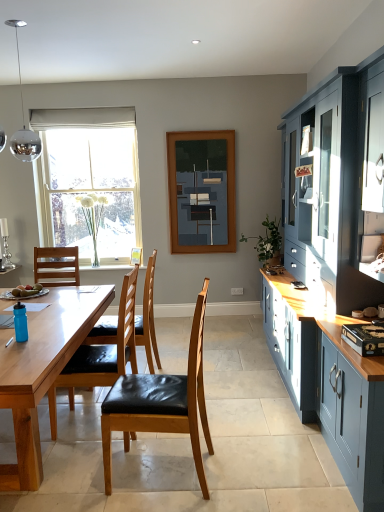
Question: Is polished chrome globe at upper left oriented towards blue plastic power plugs and sockets at lower left?

Choices:
 (A) no
 (B) yes

Answer: (A)

Question: From the image's perspective, is polished chrome globe at upper left under blue plastic power plugs and sockets at lower left?

Choices:
 (A) no
 (B) yes

Answer: (A)

Question: Is the depth of polished chrome globe at upper left less than that of blue plastic power plugs and sockets at lower left?

Choices:
 (A) no
 (B) yes

Answer: (A)

Question: Considering the relative positions of polished chrome globe at upper left and blue plastic power plugs and sockets at lower left in the image provided, is polished chrome globe at upper left to the right of blue plastic power plugs and sockets at lower left from the viewer's perspective?

Choices:
 (A) yes
 (B) no

Answer: (A)

Question: Can you confirm if polished chrome globe at upper left is smaller than blue plastic power plugs and sockets at lower left?

Choices:
 (A) yes
 (B) no

Answer: (B)

Question: Considering the positions of dark blue matte painting at center and clear glass vase at left in the image, is dark blue matte painting at center wider or thinner than clear glass vase at left?

Choices:
 (A) wide
 (B) thin

Answer: (B)

Question: Would you say dark blue matte painting at center is inside or outside clear glass vase at left?

Choices:
 (A) inside
 (B) outside

Answer: (B)

Question: From a real-world perspective, is dark blue matte painting at center physically located above or below clear glass vase at left?

Choices:
 (A) below
 (B) above

Answer: (B)

Question: Considering the positions of dark blue matte painting at center and clear glass vase at left in the image, is dark blue matte painting at center taller or shorter than clear glass vase at left?

Choices:
 (A) tall
 (B) short

Answer: (B)

Question: Looking at their shapes, would you say wooden table at center is wider or thinner than teal matte water bottle at table left?

Choices:
 (A) wide
 (B) thin

Answer: (A)

Question: Do you think wooden table at center is within teal matte water bottle at table left, or outside of it?

Choices:
 (A) outside
 (B) inside

Answer: (A)

Question: Is wooden table at center taller or shorter than teal matte water bottle at table left?

Choices:
 (A) short
 (B) tall

Answer: (B)

Question: Relative to teal matte water bottle at table left, is wooden table at center in front or behind?

Choices:
 (A) behind
 (B) front

Answer: (B)

Question: Considering the positions of brown leather chair at center, which is counted as the 1th chair, starting from the back, and dark blue matte painting at center in the image, is brown leather chair at center, which is counted as the 1th chair, starting from the back, wider or thinner than dark blue matte painting at center?

Choices:
 (A) thin
 (B) wide

Answer: (B)

Question: Is brown leather chair at center, the third chair from the front, spatially inside dark blue matte painting at center, or outside of it?

Choices:
 (A) outside
 (B) inside

Answer: (A)